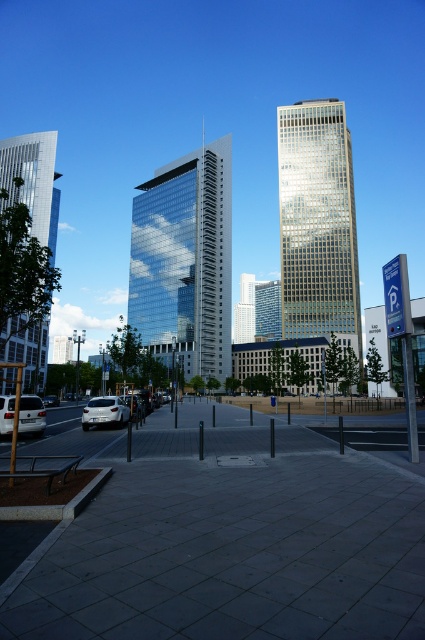
You are a delivery drone flying over the urban area. You need to land on the white glossy car at lower left without hitting the gold glass skyscraper at center. Can you safely land on the car?

The gold glass skyscraper at center might be wider than the white glossy car at lower left, so there is a risk of collision. The drone should adjust its path to avoid the wider skyscraper and ensure a safe landing on the car.

You are standing at the point marked as point (184, 260) in the image. What is the closest object to you in the scene?

The closest object to you at point (184, 260) is the glassy reflective skyscraper at center, as it is located exactly at that coordinate.